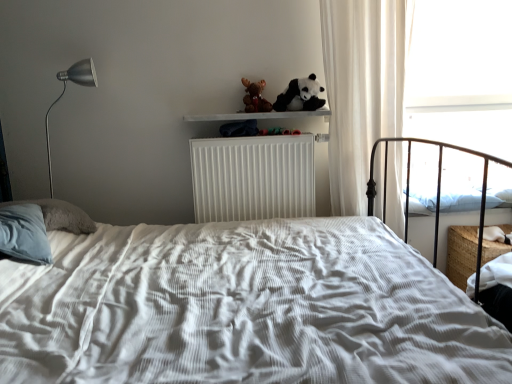
At what (x,y) coordinates should I click in order to perform the action: click on vacant area on top of white ribbed radiator at center (from a real-world perspective). Please return your answer as a coordinate pair (x, y). The image size is (512, 384). Looking at the image, I should click on (250, 130).